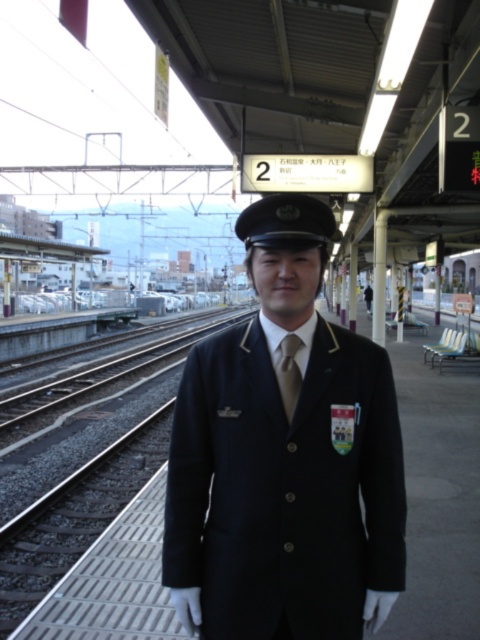
Is point (60, 301) behind point (298, 365)?

Yes.

Which is above, white glossy train at center or brown satin tie at center?

Positioned higher is white glossy train at center.

Between point (212, 294) and point (296, 380), which one is positioned behind?

Positioned behind is point (212, 294).

The image size is (480, 640). Find the location of `white glossy train at center`. white glossy train at center is located at coordinates (153, 298).

Who is more forward, (269, 632) or (292, 410)?

Point (269, 632) is in front.

Is navy blue uniform at center to the right of brown satin tie at center from the viewer's perspective?

No, navy blue uniform at center is not to the right of brown satin tie at center.

Where is `navy blue uniform at center`? The image size is (480, 640). navy blue uniform at center is located at coordinates (285, 458).

Locate an element on the screen. The image size is (480, 640). navy blue uniform at center is located at coordinates (x=285, y=458).

Who is more forward, [195,480] or [183,296]?

Positioned in front is point [195,480].

Describe the element at coordinates (285, 458) in the screenshot. This screenshot has height=640, width=480. I see `navy blue uniform at center` at that location.

Measure the distance between navy blue uniform at center and camera.

navy blue uniform at center and camera are 5.04 feet apart from each other.

I want to click on navy blue uniform at center, so click(285, 458).